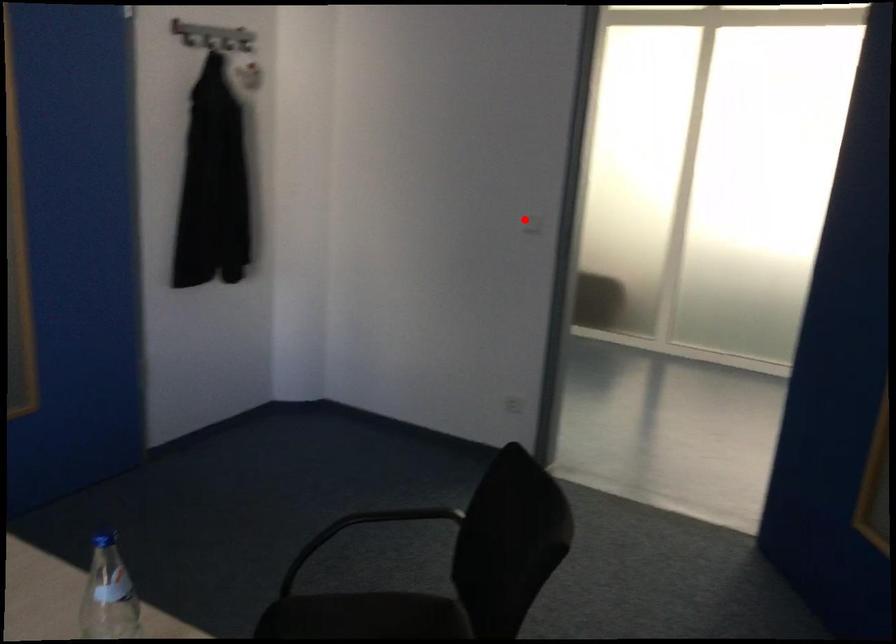
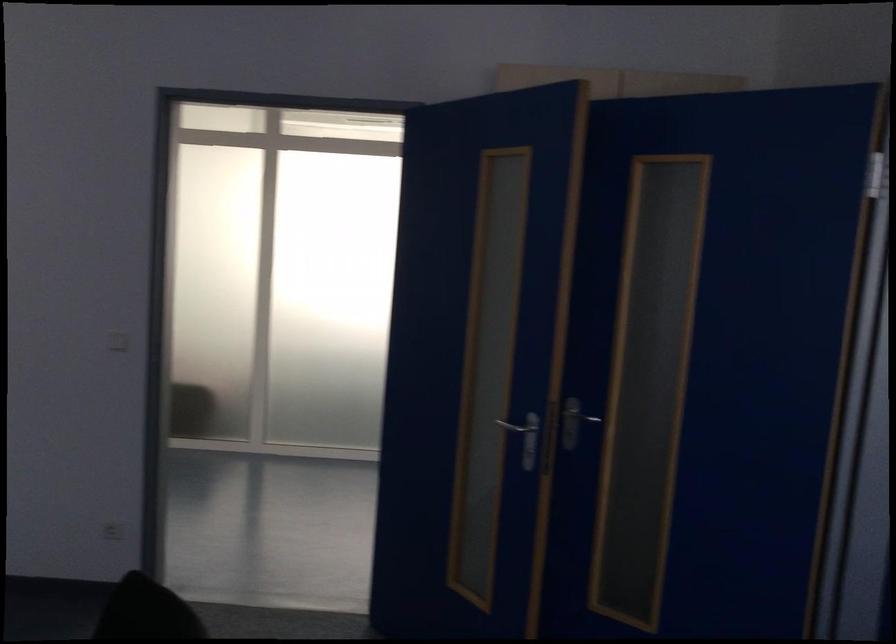
Find the pixel in the second image that matches the highlighted location in the first image.

(117, 341)